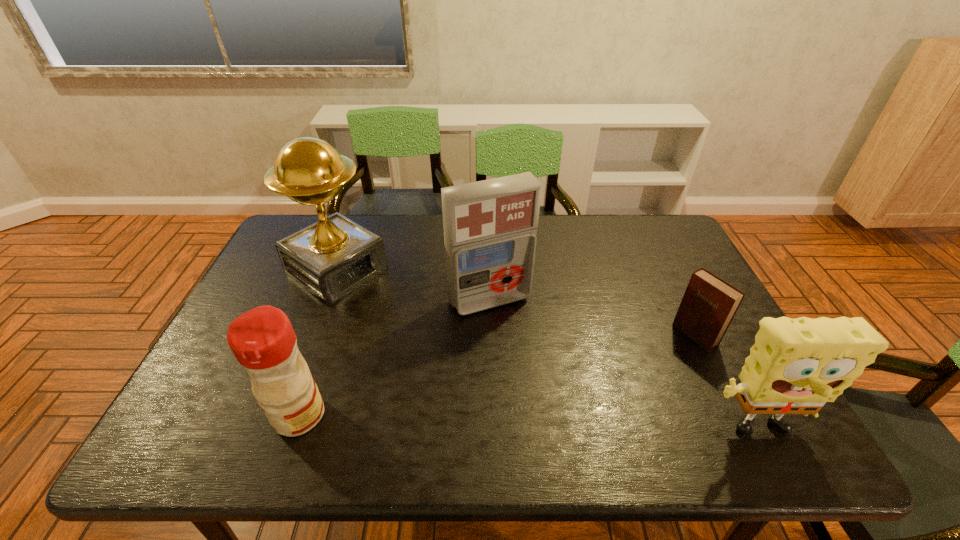
Choose which object is the nearest neighbor to the condiment. Please provide its 2D coordinates. Your answer should be formatted as a tuple, i.e. [(x, y)], where the tuple contains the x and y coordinates of a point satisfying the conditions above.

[(331, 258)]

Identify which object is located as the second nearest to the condiment. Please provide its 2D coordinates. Your answer should be formatted as a tuple, i.e. [(x, y)], where the tuple contains the x and y coordinates of a point satisfying the conditions above.

[(490, 226)]

Where is `free spot that satisfies the following two spatial constraints: 1. on the front side of the first-aid kit; 2. on the right side of the diary`? free spot that satisfies the following two spatial constraints: 1. on the front side of the first-aid kit; 2. on the right side of the diary is located at coordinates (491, 335).

Identify the location of vacant region that satisfies the following two spatial constraints: 1. on the front side of the award; 2. on the left side of the fourth shortest object. This screenshot has width=960, height=540. (326, 300).